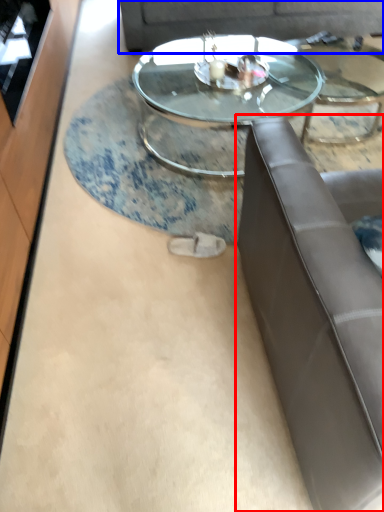
Question: Which object is further to the camera taking this photo, studio couch (highlighted by a red box) or couch (highlighted by a blue box)?

Choices:
 (A) studio couch
 (B) couch

Answer: (B)